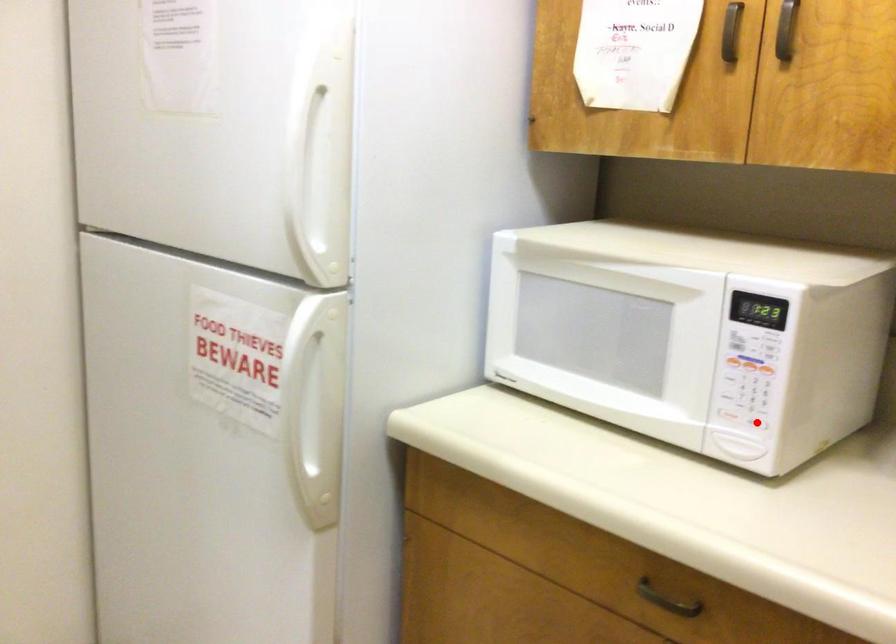
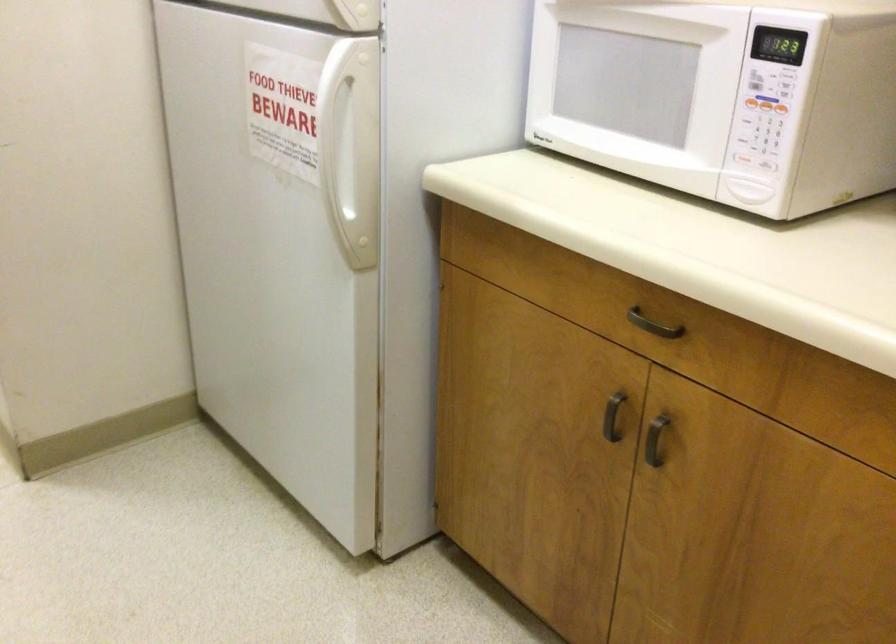
The point at the highlighted location is marked in the first image. Where is the corresponding point in the second image?

(764, 164)